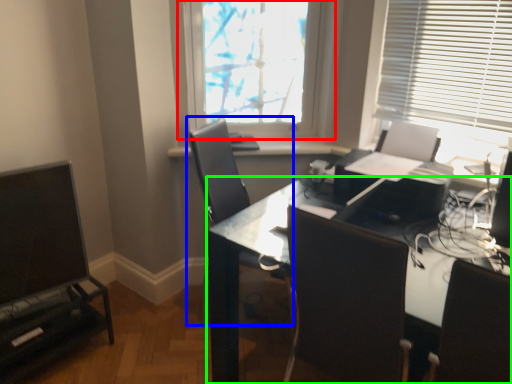
Question: Considering the real-world distances, which object is closest to window (highlighted by a red box)? chair (highlighted by a blue box) or desk (highlighted by a green box).

Choices:
 (A) chair
 (B) desk

Answer: (A)